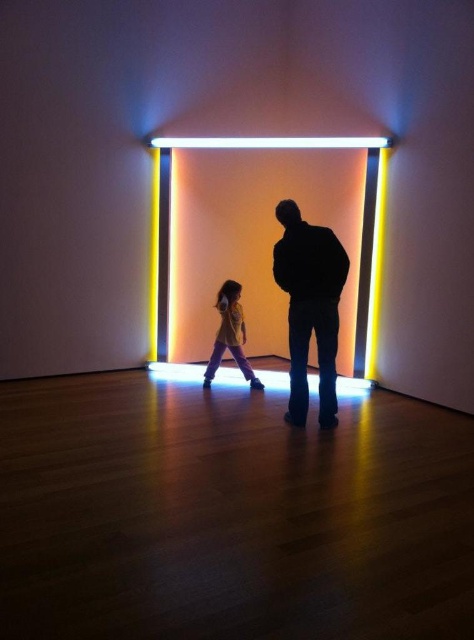
Question: Estimate the real-world distances between objects in this image. Which object is farther from the yellow cotton shirt at center?

Choices:
 (A) black matte jacket at center
 (B) white fluorescent tube at center

Answer: (A)

Question: Considering the relative positions of white fluorescent tube at center and yellow cotton shirt at center in the image provided, where is white fluorescent tube at center located with respect to yellow cotton shirt at center?

Choices:
 (A) below
 (B) above

Answer: (B)

Question: Which of the following is the farthest from the observer?

Choices:
 (A) black matte jacket at center
 (B) white fluorescent tube at center
 (C) yellow cotton shirt at center

Answer: (B)

Question: Which object is positioned farthest from the white fluorescent tube at center?

Choices:
 (A) yellow cotton shirt at center
 (B) black matte jacket at center

Answer: (B)

Question: Does white fluorescent tube at center have a smaller size compared to yellow cotton shirt at center?

Choices:
 (A) yes
 (B) no

Answer: (B)

Question: Is white fluorescent tube at center smaller than yellow cotton shirt at center?

Choices:
 (A) no
 (B) yes

Answer: (A)